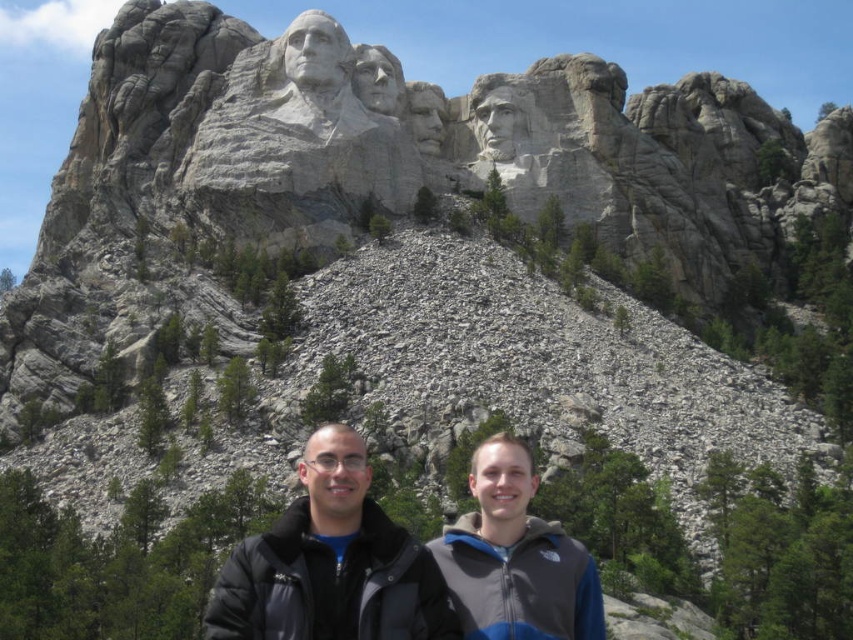
You are a photographer planning to take a photo of the granite statue at upper center and the black jacket at center. Based on their positions, which object should you focus on first to ensure both are in the frame?

The black jacket at center is located below the granite statue at upper center, so you should focus on the granite statue at upper center first to ensure both are in the frame.

You are standing at the base of Mount Rushmore National Memorial and see two points marked on the granite face. The first point is at coordinates point [509,609] and the second is at point [302,97]. Which point is closer to you?

Point [509,609] is closer to the viewer than point [302,97].

You are a tour guide leading a group to Mount Rushmore. Two tourists are standing near the monument, wearing a black jacket at center and a gray fleece jacket at lower right. They want to take a photo together. The camera can capture a maximum distance of 1.5 meters between subjects. Will the camera be able to include both tourists in the photo?

The black jacket at center and gray fleece jacket at lower right are 1.38 meters apart, which is within the camera maximum distance of 1.5 meters. Therefore, the camera can include both tourists in the photo.